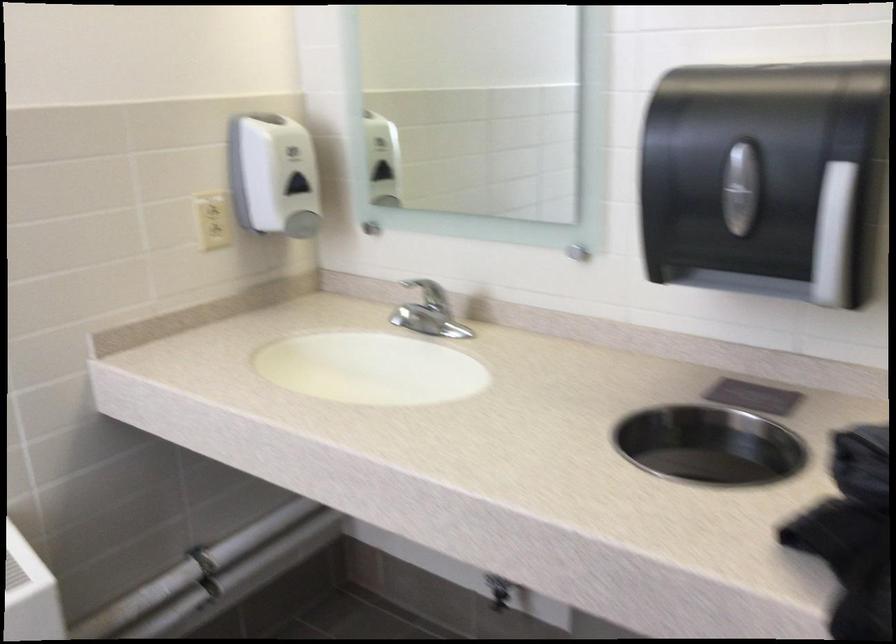
Locate an element on the screen. The height and width of the screenshot is (644, 896). soap dispenser button is located at coordinates (302, 223).